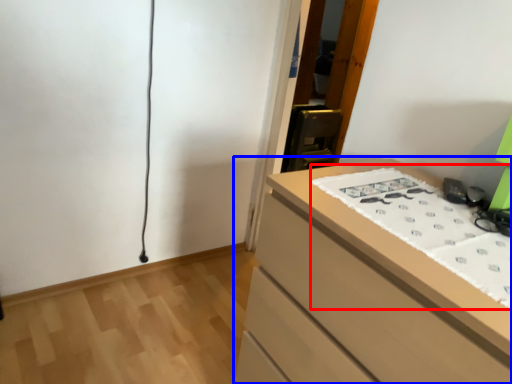
Question: Which of the following is the closest to the observer, sheet (highlighted by a red box) or chest of drawers (highlighted by a blue box)?

Choices:
 (A) sheet
 (B) chest of drawers

Answer: (B)